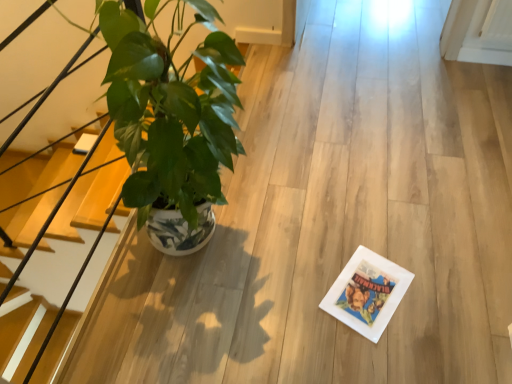
Where is `wooden at left`? This screenshot has height=384, width=512. wooden at left is located at coordinates (69, 295).

In order to face wooden at left, should I rotate leftwards or rightwards?

To face it directly, rotate left by 23.042 degrees.

What do you see at coordinates (69, 295) in the screenshot?
I see `wooden at left` at bounding box center [69, 295].

This screenshot has width=512, height=384. Describe the element at coordinates (170, 118) in the screenshot. I see `green glossy plant at left` at that location.

The width and height of the screenshot is (512, 384). Identify the location of green glossy plant at left. (170, 118).

Where is `wooden at left`? wooden at left is located at coordinates point(69,295).

Does wooden at left appear on the left side of green glossy plant at left?

Yes, wooden at left is to the left of green glossy plant at left.

Does wooden at left come behind green glossy plant at left?

No, the depth of wooden at left is less than that of green glossy plant at left.

Which is nearer, (x=84, y=263) or (x=210, y=97)?

Point (x=84, y=263).

From the image's perspective, who appears lower, wooden at left or green glossy plant at left?

wooden at left is shown below in the image.

From a real-world perspective, who is located lower, wooden at left or green glossy plant at left?

From a 3D spatial view, wooden at left is below.

Considering the sizes of objects wooden at left and green glossy plant at left in the image provided, who is thinner, wooden at left or green glossy plant at left?

Thinner between the two is wooden at left.

Considering the sizes of wooden at left and green glossy plant at left in the image, is wooden at left taller or shorter than green glossy plant at left?

In the image, wooden at left appears to be shorter than green glossy plant at left.

Based on their sizes in the image, would you say wooden at left is bigger or smaller than green glossy plant at left?

Considering their sizes, wooden at left takes up less space than green glossy plant at left.

Is green glossy plant at left inside wooden at left?

No, green glossy plant at left is not a part of wooden at left.

Is wooden at left touching green glossy plant at left?

wooden at left and green glossy plant at left are not in contact.

Consider the image. Is green glossy plant at left at the back of wooden at left?

Yes, wooden at left is positioned with its back facing green glossy plant at left.

What's the angular difference between wooden at left and green glossy plant at left's facing directions?

0.00213 degrees separate the facing orientations of wooden at left and green glossy plant at left.

Locate an element on the screen. stairs on the left of the green glossy plant at left is located at coordinates (69, 295).

Is green glossy plant at left at the right side of wooden at left?

Indeed, green glossy plant at left is positioned on the right side of wooden at left.

Does green glossy plant at left lie behind wooden at left?

That is True.

Which is less distant, (223, 116) or (71, 182)?

The point (223, 116) is in front.

From the image's perspective, is green glossy plant at left located above wooden at left?

Yes, from the image's perspective, green glossy plant at left is over wooden at left.

From a real-world perspective, which is physically above, green glossy plant at left or wooden at left?

From a 3D spatial view, green glossy plant at left is above.

Is green glossy plant at left thinner than wooden at left?

No, green glossy plant at left is not thinner than wooden at left.

Consider the image. Who is taller, green glossy plant at left or wooden at left?

green glossy plant at left is taller.

Does green glossy plant at left have a larger size compared to wooden at left?

Indeed, green glossy plant at left has a larger size compared to wooden at left.

Is green glossy plant at left positioned beyond the bounds of wooden at left?

Yes.

Is green glossy plant at left far from wooden at left?

No, green glossy plant at left is in close proximity to wooden at left.

Could you tell me if green glossy plant at left is turned towards wooden at left?

No, green glossy plant at left is not facing towards wooden at left.

How different are the orientations of green glossy plant at left and wooden at left in degrees?

0.00213 degrees.

This screenshot has width=512, height=384. What are the coordinates of `houseplant above the wooden at left (from a real-world perspective)` in the screenshot? It's located at (170, 118).

At what (x,y) coordinates should I click in order to perform the action: click on stairs beneath the green glossy plant at left (from a real-world perspective). Please return your answer as a coordinate pair (x, y). Looking at the image, I should click on (69, 295).

There is a wooden at left. At what (x,y) coordinates should I click in order to perform the action: click on houseplant above it (from a real-world perspective). Please return your answer as a coordinate pair (x, y). This screenshot has width=512, height=384. Looking at the image, I should click on (170, 118).